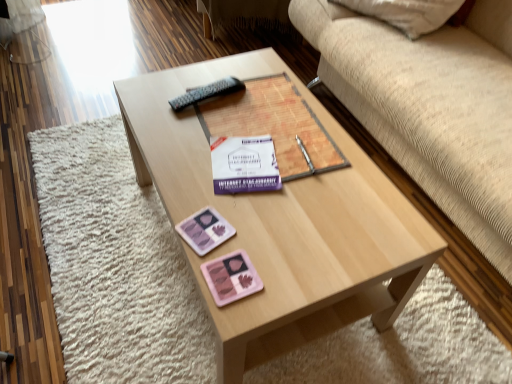
This screenshot has height=384, width=512. I want to click on free location to the right of pink matte eyeshadow palette at lower center, which is the second currency from top to bottom, so click(305, 269).